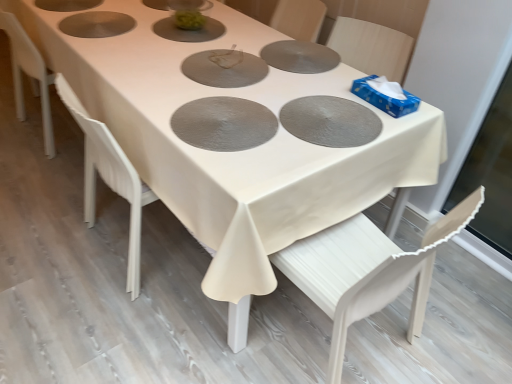
What are the coordinates of `free point below white wood chair at lower right (from a real-world perspective)` in the screenshot? It's located at (346, 345).